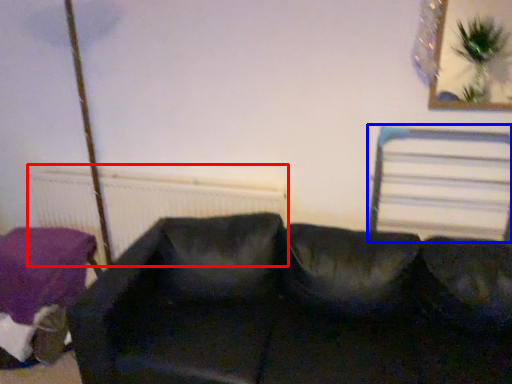
Question: Which object appears farthest to the camera in this image, radiator (highlighted by a red box) or bed frame (highlighted by a blue box)?

Choices:
 (A) radiator
 (B) bed frame

Answer: (A)